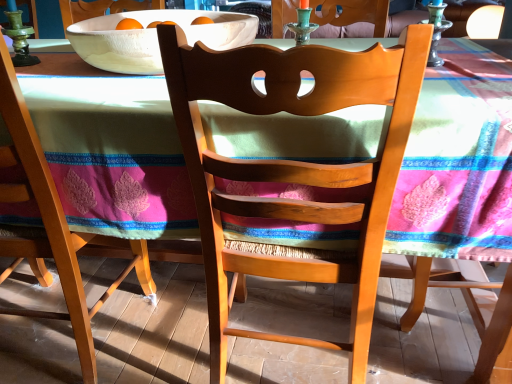
Question: Based on their positions, is wooden chair at left, acting as the second chair starting from the right, located to the left or right of green glass candle holder at upper center, placed as the first candle holder when sorted from left to right?

Choices:
 (A) left
 (B) right

Answer: (A)

Question: Considering the positions of wooden chair at left, which is the first chair in left-to-right order, and green glass candle holder at upper center, placed as the first candle holder when sorted from left to right, in the image, is wooden chair at left, which is the first chair in left-to-right order, wider or thinner than green glass candle holder at upper center, placed as the first candle holder when sorted from left to right,?

Choices:
 (A) wide
 (B) thin

Answer: (A)

Question: Which of these objects is positioned closest to the textured cotton tablecloth at center?

Choices:
 (A) green glass candle holder at upper center, which ranks as the 2th candle holder in right-to-left order
 (B) wooden chair at left, which is the first chair in left-to-right order
 (C) green glass candle holder at upper right, the second candle holder in the left-to-right sequence
 (D) white matte bowl at upper center
 (E) matte wood chair at center, the 2th chair viewed from the left

Answer: (E)

Question: Estimate the real-world distances between objects in this image. Which object is closer to the wooden chair at left, which is the first chair in left-to-right order?

Choices:
 (A) green glass candle holder at upper right, arranged as the 1th candle holder when viewed from the right
 (B) green glass candle holder at upper center, placed as the first candle holder when sorted from left to right
 (C) white matte bowl at upper center
 (D) textured cotton tablecloth at center
 (E) matte wood chair at center, which ranks as the 1th chair in right-to-left order

Answer: (D)